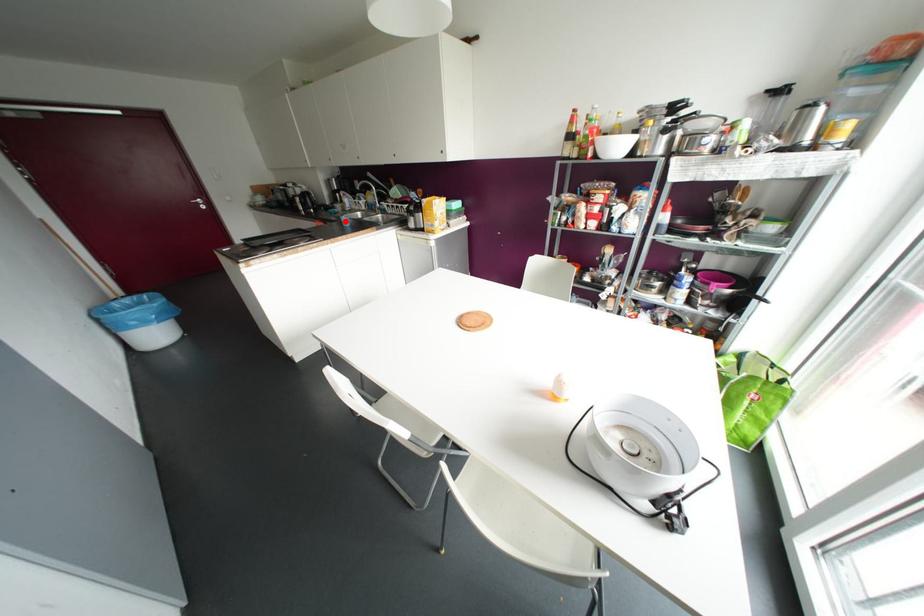
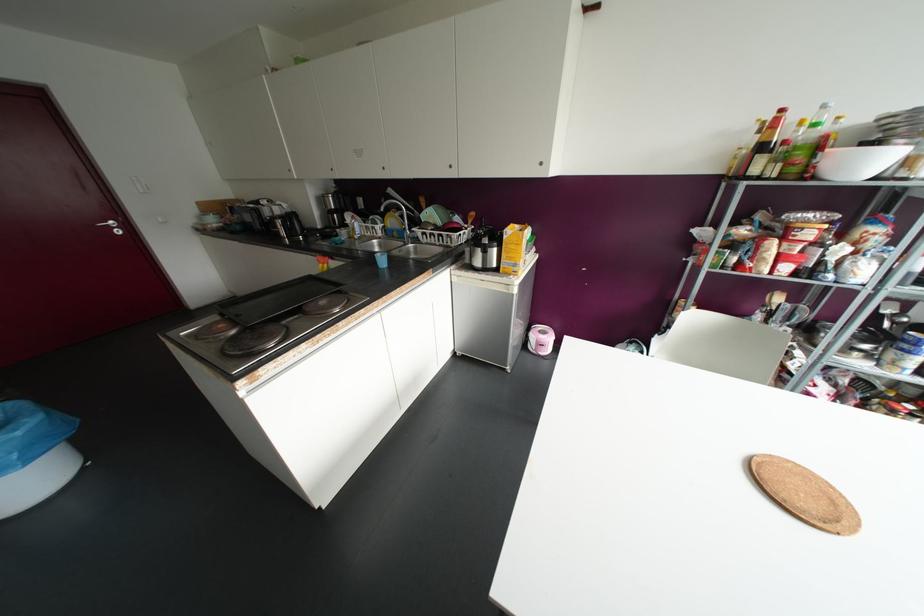
Locate, in the second image, the point that corresponds to the highlighted location in the first image.

(382, 261)